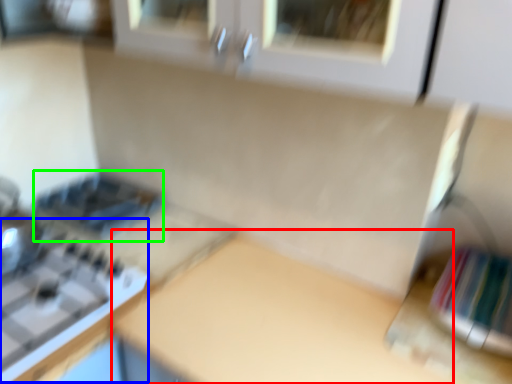
Question: Which object is positioned farthest from counter top (highlighted by a red box)? Select from gas stove (highlighted by a blue box) and appliance (highlighted by a green box).

Choices:
 (A) gas stove
 (B) appliance

Answer: (B)